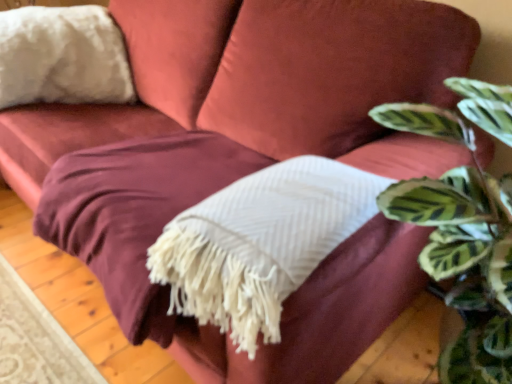
Question: Is point (474, 190) positioned closer to the camera than point (243, 271)?

Choices:
 (A) farther
 (B) closer

Answer: (A)

Question: In terms of height, does green striped leaf at upper right look taller or shorter compared to white textured blanket at center?

Choices:
 (A) tall
 (B) short

Answer: (A)

Question: Based on their relative distances, which object is nearer to the green striped leaf at upper right?

Choices:
 (A) white fluffy pillow at upper left
 (B) white textured blanket at center

Answer: (B)

Question: Which of these objects is positioned closest to the white fluffy pillow at upper left?

Choices:
 (A) white textured blanket at center
 (B) green striped leaf at upper right

Answer: (A)